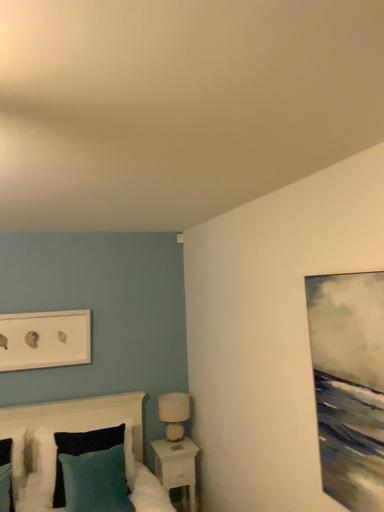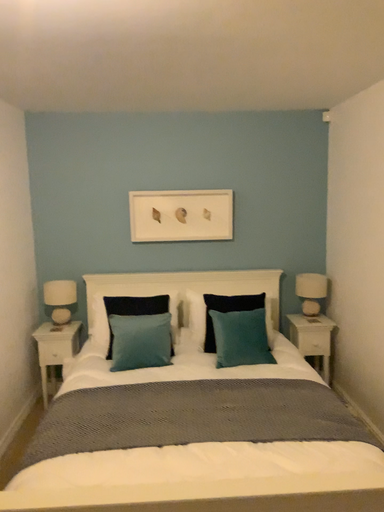
Question: How did the camera likely rotate when shooting the video?

Choices:
 (A) rotated downward
 (B) rotated upward

Answer: (A)